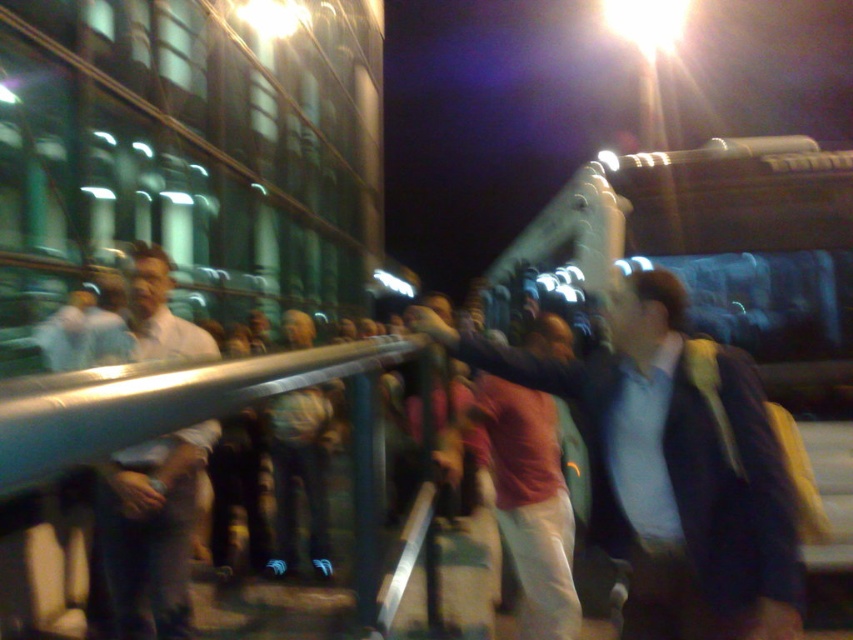
Consider the image. You are at an outdoor event and see a person wearing a white shirt at left and another wearing denim pants at center. Which clothing item is smaller in size?

The white shirt at left is smaller in size compared to the denim pants at center.

Based on the photo, you are at the event and want to locate the person wearing the white shirt at left. According to the coordinates provided, where should you look on the image?

The white shirt at left is located at point (151, 531) on the image.